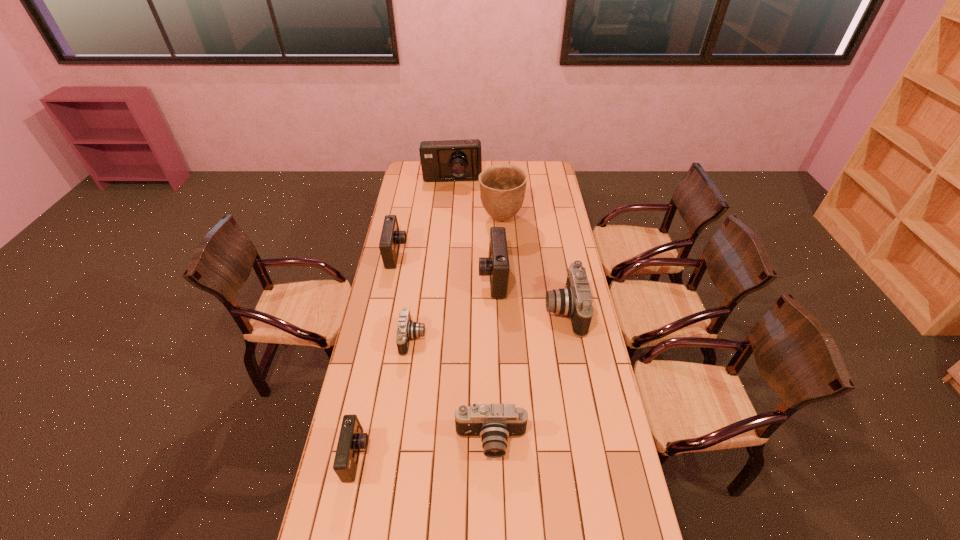
Where is `the fourth closest camera relative to the second biggest blue camera`? Image resolution: width=960 pixels, height=540 pixels. the fourth closest camera relative to the second biggest blue camera is located at coordinates (494, 423).

Identify the location of blue camera that is the fourth closest to the second black camera from left to right. This screenshot has height=540, width=960. (448, 160).

This screenshot has height=540, width=960. Find the location of `blue camera that is the closest to the nearest blue camera`. blue camera that is the closest to the nearest blue camera is located at coordinates (496, 265).

This screenshot has width=960, height=540. I want to click on black camera that can be found as the third closest to the pottery, so click(x=494, y=423).

Locate an element on the screen. Image resolution: width=960 pixels, height=540 pixels. black camera that stands as the closest to the tallest camera is located at coordinates (575, 300).

Identify the location of free space in the image that satisfies the following two spatial constraints: 1. on the front-facing side of the farthest camera; 2. on the front-facing side of the second smallest blue camera. The height and width of the screenshot is (540, 960). (446, 254).

The height and width of the screenshot is (540, 960). Identify the location of free location that satisfies the following two spatial constraints: 1. on the front-facing side of the second biggest blue camera; 2. on the front-facing side of the second smallest black camera. (497, 442).